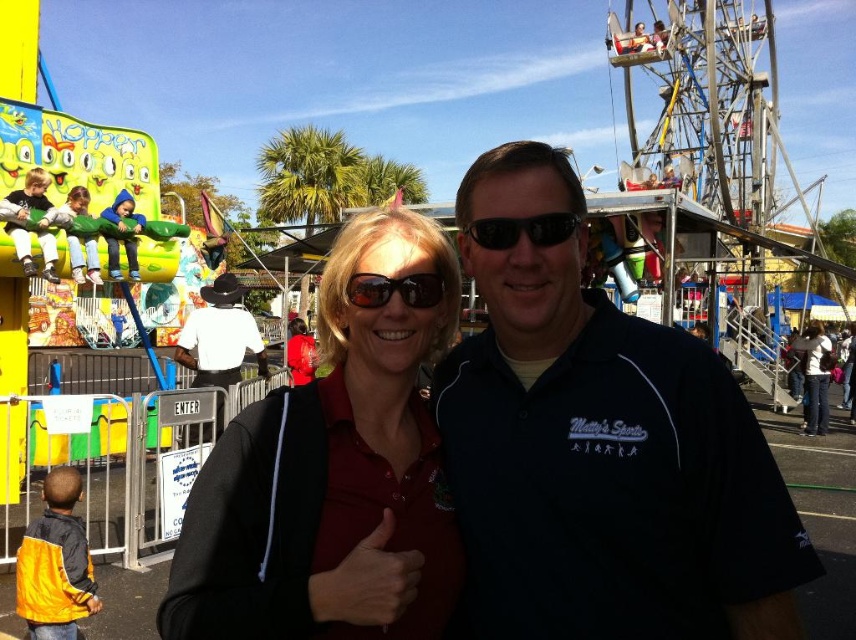
Question: Estimate the real-world distances between objects in this image. Which object is farther from the black matte sunglasses at center?

Choices:
 (A) white fabric purse at right
 (B) dark blue shirt at center

Answer: (A)

Question: Does matte black jacket at center appear on the right side of white fabric purse at right?

Choices:
 (A) no
 (B) yes

Answer: (A)

Question: Among these objects, which one is farthest from the camera?

Choices:
 (A) white fabric purse at right
 (B) sunglasses at center

Answer: (A)

Question: Can you confirm if dark blue shirt at center is bigger than matte black jacket at center?

Choices:
 (A) yes
 (B) no

Answer: (A)

Question: Does matte black jacket at center appear under white fabric purse at right?

Choices:
 (A) yes
 (B) no

Answer: (B)

Question: Which point is farther to the camera?

Choices:
 (A) (367, 275)
 (B) (810, 340)
 (C) (759, 428)
 (D) (373, 637)

Answer: (B)